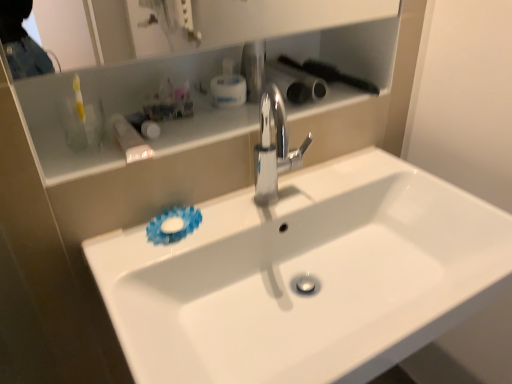
Where is `blank area to the left of polished chrome faucet at center`? blank area to the left of polished chrome faucet at center is located at coordinates (226, 218).